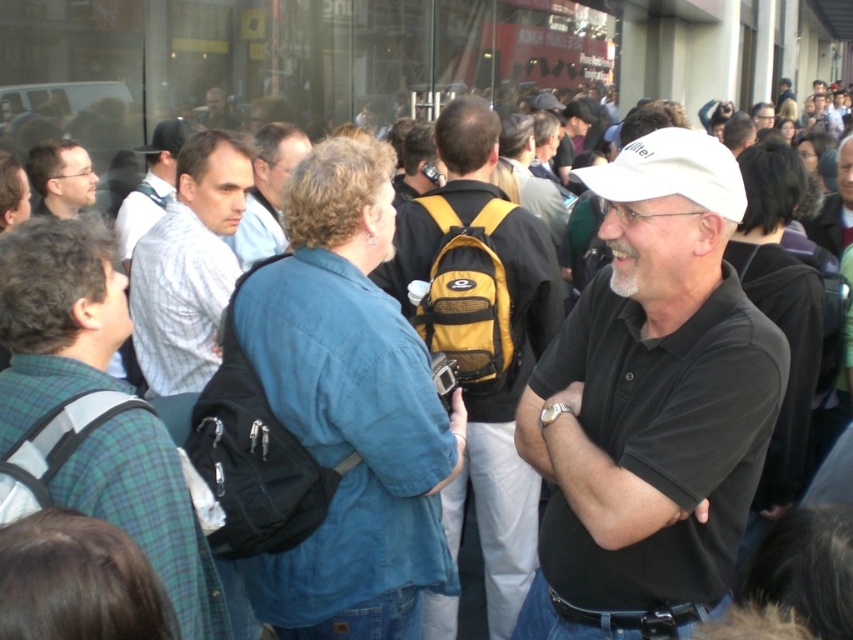
Which of these two, white striped shirt at center or matte black backpack at center, stands taller?

With more height is white striped shirt at center.

Who is more forward, (213,224) or (236,125)?

Point (213,224) is more forward.

Is point (154, 228) positioned in front of point (224, 97)?

Yes.

I want to click on white striped shirt at center, so click(189, 264).

Between plaid fabric shirt at left and matte black backpack at center, which one appears on the right side from the viewer's perspective?

plaid fabric shirt at left is more to the right.

Between plaid fabric shirt at left and matte black backpack at center, which one has less height?

matte black backpack at center is shorter.

Which is in front, point (65, 474) or point (231, 124)?

Point (65, 474) is more forward.

Find the location of a particular element. The width and height of the screenshot is (853, 640). plaid fabric shirt at left is located at coordinates (56, 316).

Based on the photo, is yellow backpack at center positioned at the back of light blue shirt at center?

No, it is not.

Identify the location of yellow backpack at center. (508, 422).